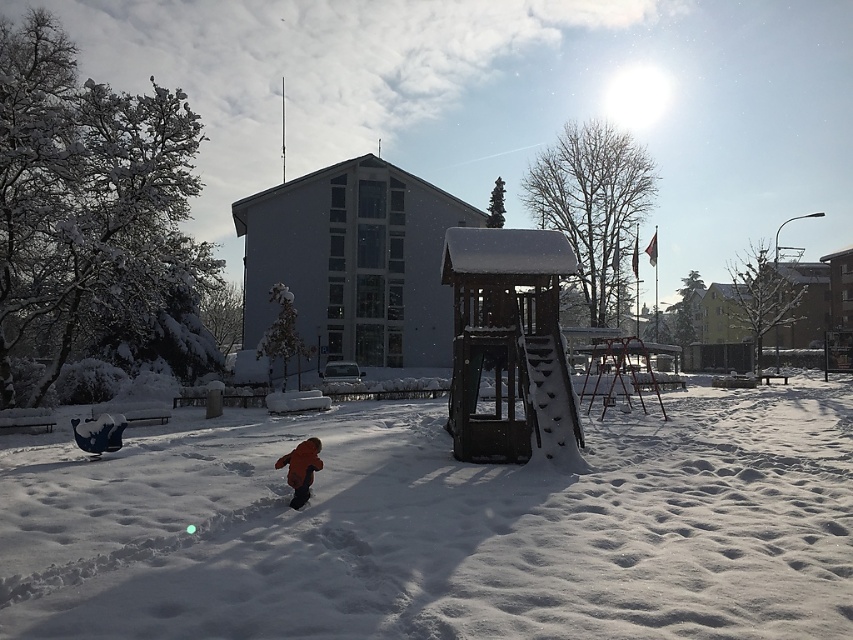
Is white fluffy snow at center to the left of orange fuzzy coat at center from the viewer's perspective?

No, white fluffy snow at center is not to the left of orange fuzzy coat at center.

Between white fluffy snow at center and orange fuzzy coat at center, which one is positioned higher?

Positioned higher is orange fuzzy coat at center.

Is point (691, 435) positioned before point (312, 436)?

No, (691, 435) is behind (312, 436).

This screenshot has width=853, height=640. Find the location of `white fluffy snow at center`. white fluffy snow at center is located at coordinates 444,531.